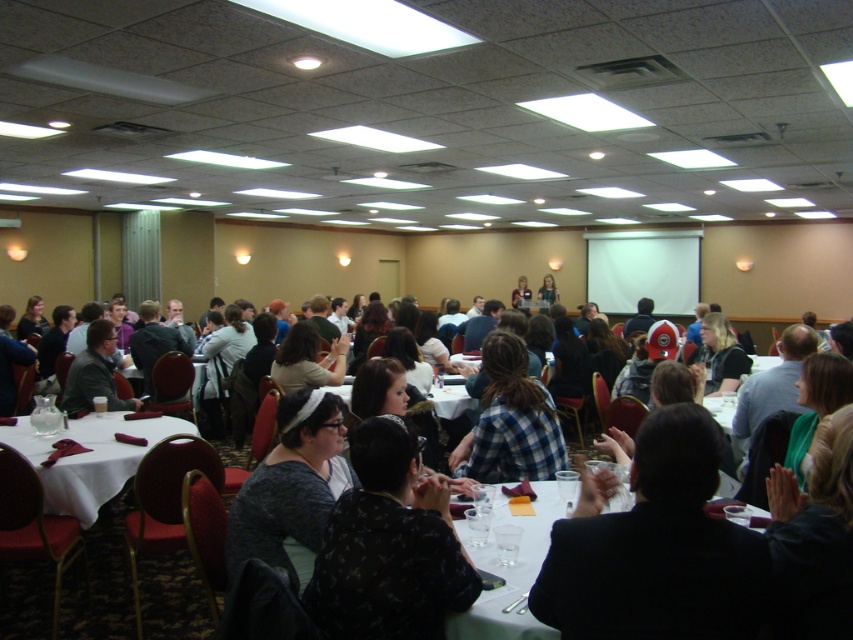
You are sitting at the back of the conference room and want to see the presentation on the white matte projection screen at upper center. However, there is a person wearing the matte black jacket at center. Can you see the screen clearly?

The matte black jacket at center is behind the white matte projection screen at upper center, so the person wearing it is not blocking your view of the screen.

Consider the image. You are sitting at the back of the conference room and notice two people wearing the dark gray textured sweater at center and the blue plaid shirt at center. Which clothing item is closer to the floor?

The dark gray textured sweater at center is closer to the floor because it is below the blue plaid shirt at center.